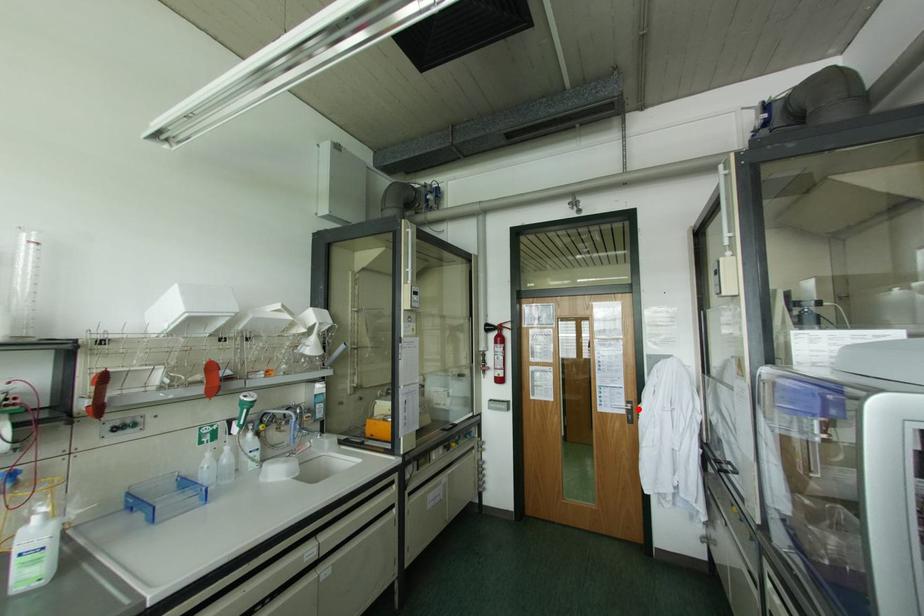
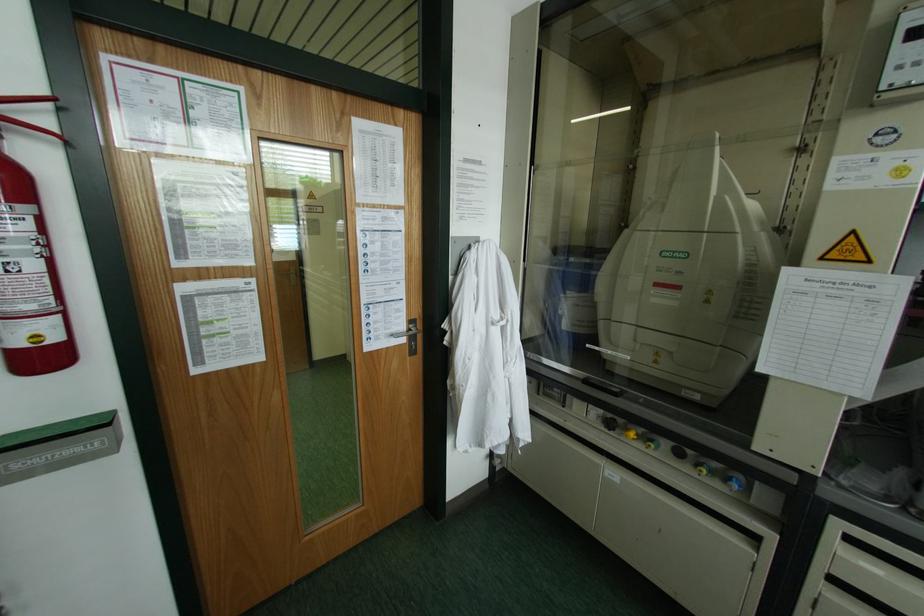
Where in the second image is the point corresponding to the highlighted location from the first image?

(444, 331)